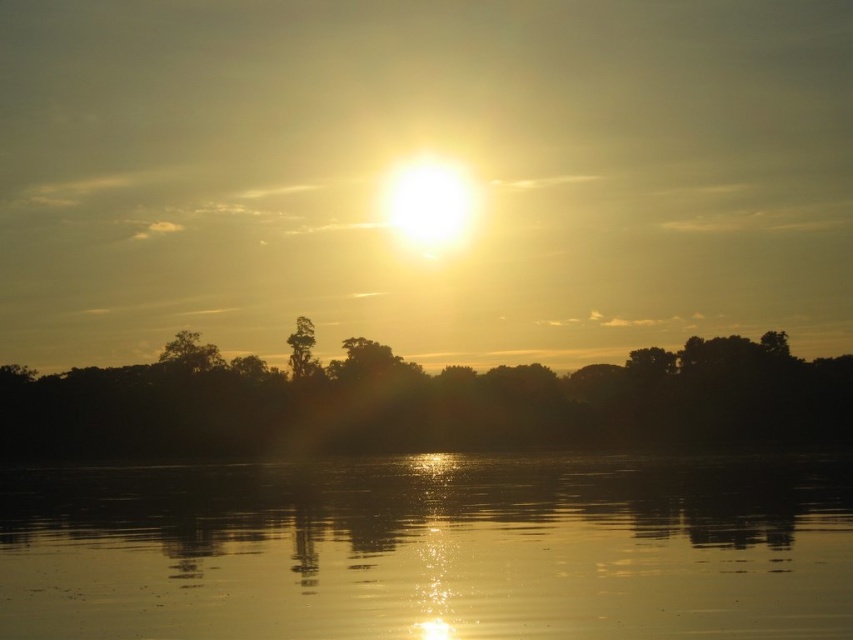
You are standing at the point closer to the camera in the image. Which point are you at, point (653, 580) or point (840, 376)?

You are at point (653, 580) because it is closer to the camera than point (840, 376).

You are standing on the shore and want to take a photo of the golden reflective water at center and the silhouette tree at center. Which object will appear wider in the photo?

The silhouette tree at center will appear wider in the photo because its width is greater than the golden reflective water at center.